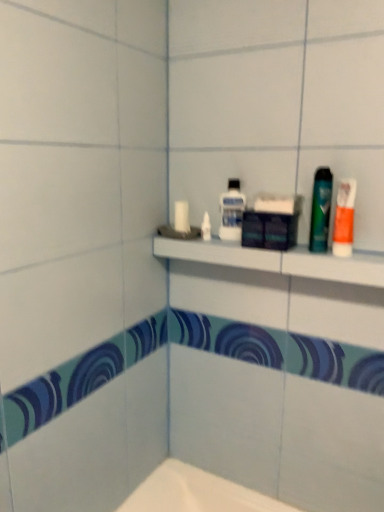
At what (x,y) coordinates should I click in order to perform the action: click on empty space that is ontop of white plastic shelf at upper center. Please return your answer as a coordinate pair (x, y). Looking at the image, I should click on point(263,243).